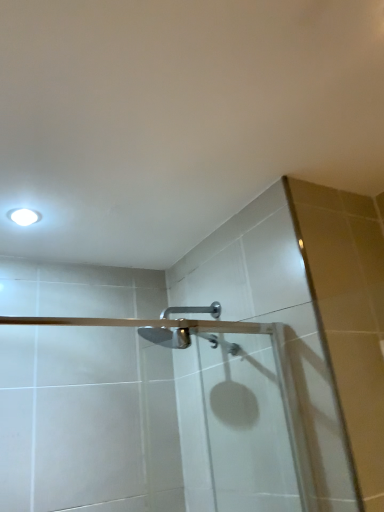
This screenshot has width=384, height=512. What do you see at coordinates (24, 216) in the screenshot? I see `white glossy light fixture at upper left` at bounding box center [24, 216].

Find the location of `white glossy light fixture at upper left`. white glossy light fixture at upper left is located at coordinates (24, 216).

Locate an element on the screen. white glossy light fixture at upper left is located at coordinates (24, 216).